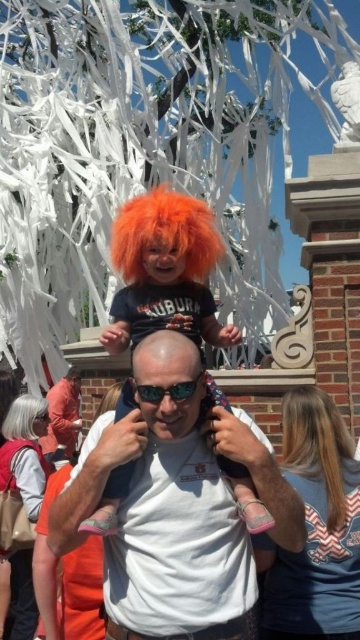
Does orange synthetic wig at center appear on the right side of blonde silky hair at upper right?

No, orange synthetic wig at center is not to the right of blonde silky hair at upper right.

Which is more to the left, orange synthetic wig at center or blonde silky hair at upper right?

orange synthetic wig at center

Find the location of `orange synthetic wig at center`. orange synthetic wig at center is located at coordinates (164, 234).

The width and height of the screenshot is (360, 640). I want to click on orange synthetic wig at center, so click(164, 234).

Does white matte shirt at center have a greater width compared to orange synthetic wig at center?

Correct, the width of white matte shirt at center exceeds that of orange synthetic wig at center.

Locate an element on the screen. This screenshot has width=360, height=640. white matte shirt at center is located at coordinates (177, 515).

Identify the location of white matte shirt at center. This screenshot has height=640, width=360. (177, 515).

Is the position of white matte shirt at center less distant than that of gray/silver hair at upper left?

Yes, it is.

Based on the photo, can you confirm if white matte shirt at center is thinner than gray/silver hair at upper left?

No.

Is point (192, 627) positioned before point (7, 417)?

Yes, point (192, 627) is in front of point (7, 417).

Find the location of a particular element. white matte shirt at center is located at coordinates (177, 515).